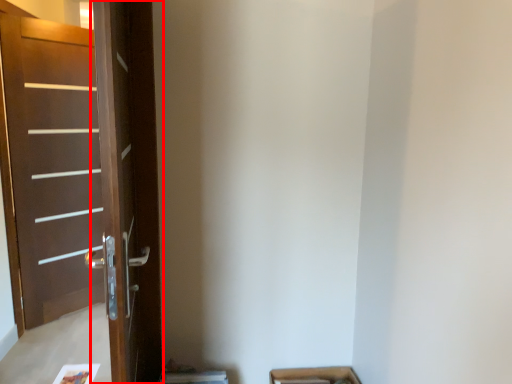
Question: From the image's perspective, where is screen door (annotated by the red box) located relative to door?

Choices:
 (A) below
 (B) above

Answer: (A)